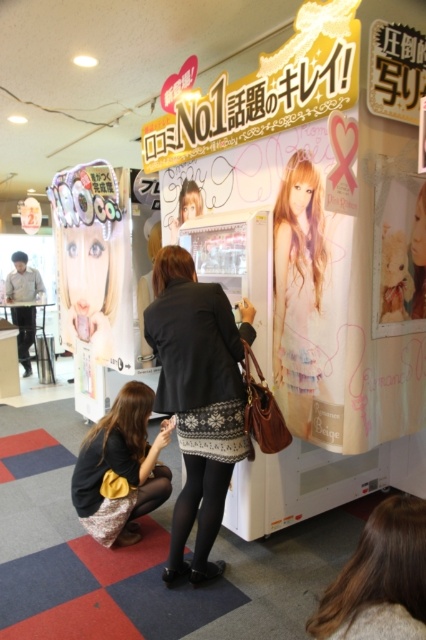
Question: Which object appears closest to the camera in this image?

Choices:
 (A) matte black skirt at lower left
 (B) blonde hair at lower center
 (C) black textured sweater at center

Answer: (B)

Question: Observing the image, what is the correct spatial positioning of blonde hair at lower center in reference to matte black skirt at lower left?

Choices:
 (A) left
 (B) right

Answer: (B)

Question: Does black textured sweater at center have a greater width compared to blonde hair at lower center?

Choices:
 (A) no
 (B) yes

Answer: (B)

Question: Does black textured sweater at center have a larger size compared to matte black skirt at lower left?

Choices:
 (A) no
 (B) yes

Answer: (B)

Question: Which point is closer to the camera taking this photo?

Choices:
 (A) (103, 486)
 (B) (350, 616)

Answer: (B)

Question: Which is nearer to the matte black skirt at lower left?

Choices:
 (A) blonde hair at lower center
 (B) black textured sweater at center

Answer: (B)